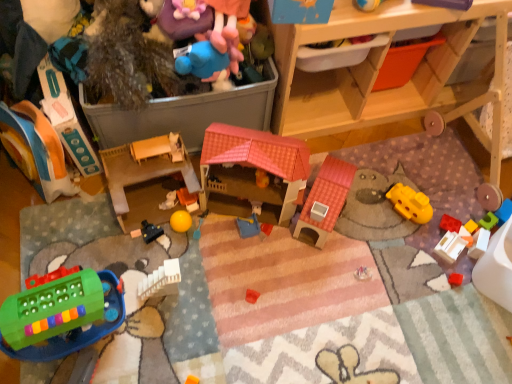
At what (x,y) coordinates should I click in order to perform the action: click on free space between smooth orange ball at center, positioned as the 7th toy in left-to-right order, and white plastic toy at lower right, which is counted as the tenth toy, starting from the left. Please return your answer as a coordinate pair (x, y). Looking at the image, I should click on [338, 233].